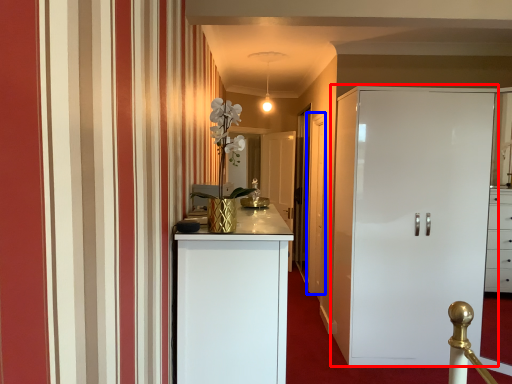
Question: Which object appears closest to the camera in this image, cupboard (highlighted by a red box) or door (highlighted by a blue box)?

Choices:
 (A) cupboard
 (B) door

Answer: (A)